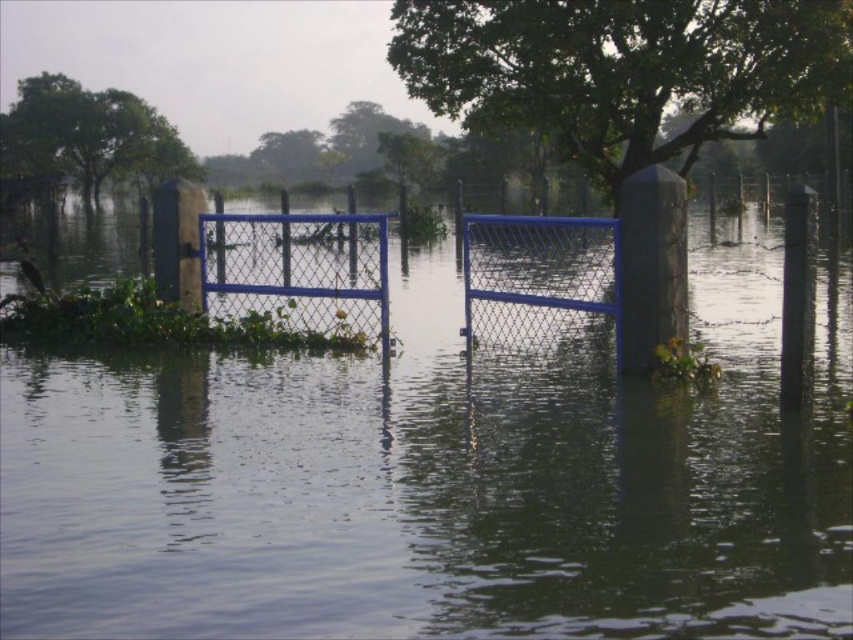
Question: Observing the image, what is the correct spatial positioning of blue metallic gate at center in reference to black plastic pole at right?

Choices:
 (A) left
 (B) right

Answer: (A)

Question: Which point is closer to the camera?

Choices:
 (A) blue metallic gate at center
 (B) black plastic pole at right
 (C) green leafy tree at upper center
 (D) blue chain-link fence at center

Answer: (A)

Question: Is blue chain-link fence at center above green leafy tree at upper left?

Choices:
 (A) yes
 (B) no

Answer: (B)

Question: Does blue metallic gate at center have a smaller size compared to green leafy tree at upper center?

Choices:
 (A) no
 (B) yes

Answer: (A)

Question: Estimate the real-world distances between objects in this image. Which object is farther from the green leafy tree at center?

Choices:
 (A) green leafy tree at upper center
 (B) green leafy tree at upper left

Answer: (A)

Question: Which of these objects is positioned closest to the black plastic pole at right?

Choices:
 (A) green leafy tree at upper left
 (B) green leafy tree at upper center
 (C) blue chain-link fence at center
 (D) blue metallic gate at center

Answer: (D)